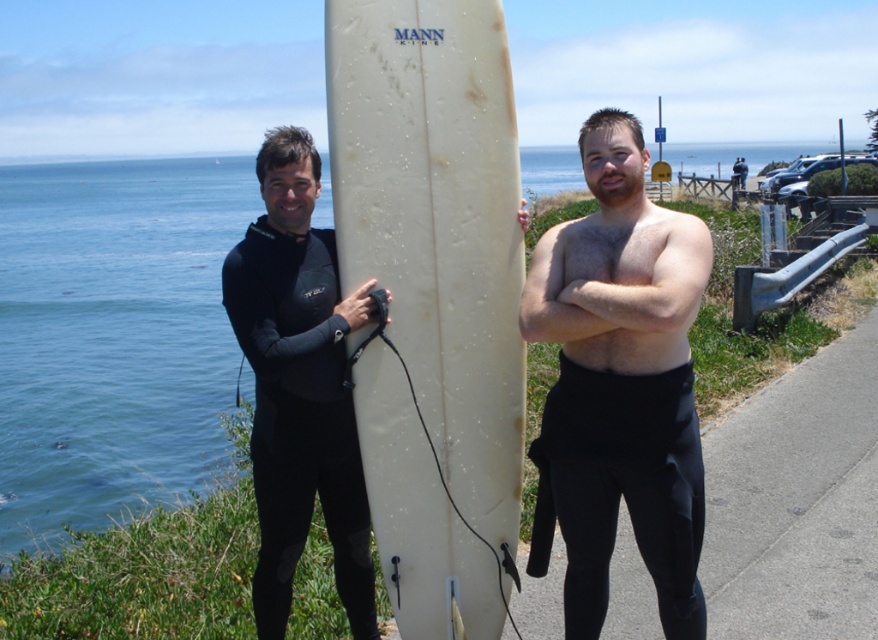
You are a photographer trying to capture a closeup shot of the text on the white matte surfboard at center. The shiny black wetsuit at center is blocking your view. Can you determine if moving the surfboard closer to you will make the text larger in your photo?

The white matte surfboard at center has a smaller size compared to shiny black wetsuit at center. Moving the surfboard closer to you will make the text appear larger in the photo, but since the surfboard itself is smaller, it might still be challenging to capture the text clearly if the wetsuit is blocking the view.

You are a photographer trying to capture a wide shot of the scene. The white matte surfboard at center and the black matte wetsuit at center are both in the frame. If you want to ensure both objects are fully visible without cropping, which object requires more horizontal space in the frame?

The black matte wetsuit at center requires more horizontal space in the frame because its width is greater than the white matte surfboard at center.